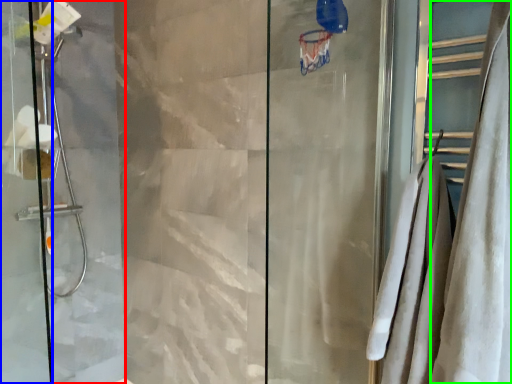
Question: Considering the real-world distances, which object is closest to screen door (highlighted by a red box)? screen door (highlighted by a blue box) or shower curtain (highlighted by a green box).

Choices:
 (A) screen door
 (B) shower curtain

Answer: (A)